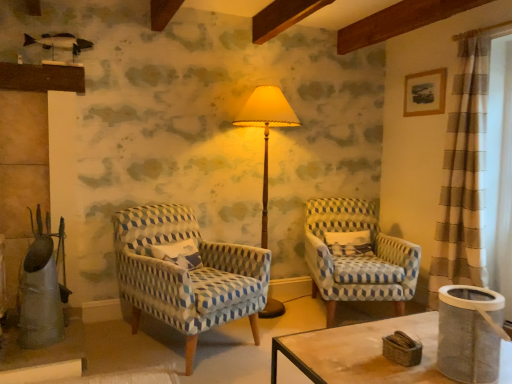
Question: Is matte yellow fabric lampshade at center behind white textured pillow at center?

Choices:
 (A) no
 (B) yes

Answer: (A)

Question: From a real-world perspective, is matte yellow fabric lampshade at center positioned under white textured pillow at center based on gravity?

Choices:
 (A) no
 (B) yes

Answer: (A)

Question: From a real-world perspective, is matte yellow fabric lampshade at center over white textured pillow at center?

Choices:
 (A) yes
 (B) no

Answer: (A)

Question: From the image's perspective, would you say matte yellow fabric lampshade at center is positioned over white textured pillow at center?

Choices:
 (A) no
 (B) yes

Answer: (B)

Question: Does matte yellow fabric lampshade at center have a lesser width compared to white textured pillow at center?

Choices:
 (A) yes
 (B) no

Answer: (B)

Question: Is matte yellow fabric lampshade at center to the left of white textured pillow at center from the viewer's perspective?

Choices:
 (A) yes
 (B) no

Answer: (A)

Question: From the image's perspective, does blue patterned fabric chair at center, the 1th chair in the right-to-left sequence, appear higher than white mesh screen at right?

Choices:
 (A) no
 (B) yes

Answer: (A)

Question: Is blue patterned fabric chair at center, the 1th chair in the right-to-left sequence, not close to white mesh screen at right?

Choices:
 (A) no
 (B) yes

Answer: (A)

Question: Considering the relative sizes of blue patterned fabric chair at center, which is the second chair from left to right, and white mesh screen at right in the image provided, is blue patterned fabric chair at center, which is the second chair from left to right, thinner than white mesh screen at right?

Choices:
 (A) no
 (B) yes

Answer: (A)

Question: Can you confirm if blue patterned fabric chair at center, the 1th chair in the right-to-left sequence, is positioned to the right of white mesh screen at right?

Choices:
 (A) yes
 (B) no

Answer: (B)

Question: Is blue patterned fabric chair at center, the 1th chair in the right-to-left sequence, at the left side of white mesh screen at right?

Choices:
 (A) no
 (B) yes

Answer: (B)

Question: From a real-world perspective, is blue patterned fabric chair at center, the 1th chair in the right-to-left sequence, positioned under white mesh screen at right based on gravity?

Choices:
 (A) yes
 (B) no

Answer: (A)

Question: Is white textured pillow at center shorter than matte yellow fabric lampshade at center?

Choices:
 (A) no
 (B) yes

Answer: (B)